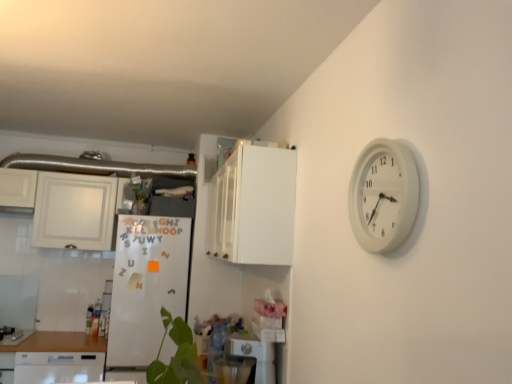
Locate an element on the screen. white plastic wall clock at upper right is located at coordinates (383, 195).

What is the approximate height of white glossy dishwasher at lower left?

white glossy dishwasher at lower left is 17.76 inches in height.

This screenshot has height=384, width=512. What are the coordinates of `white glossy cabinet at upper center, which is the first cabinetry in front-to-back order` in the screenshot? It's located at (253, 207).

From the image's perspective, would you say white glossy cabinet at upper left, placed as the second cabinetry when sorted from front to back, is shown under brushed metal gas stove at lower left?

No, from the image's perspective, white glossy cabinet at upper left, placed as the second cabinetry when sorted from front to back, is not below brushed metal gas stove at lower left.

Between white glossy cabinet at upper left, the 1th cabinetry when ordered from back to front, and brushed metal gas stove at lower left, which one has smaller width?

With smaller width is white glossy cabinet at upper left, the 1th cabinetry when ordered from back to front.

Is point (103, 225) positioned after point (29, 330)?

No.

Between brushed metal gas stove at lower left and white plastic wall clock at upper right, which one has more height?

white plastic wall clock at upper right is taller.

Can you confirm if brushed metal gas stove at lower left is wider than white plastic wall clock at upper right?

Yes.

Which of these two, brushed metal gas stove at lower left or white plastic wall clock at upper right, is bigger?

Bigger between the two is brushed metal gas stove at lower left.

Is brushed metal gas stove at lower left aimed at white plastic wall clock at upper right?

No, brushed metal gas stove at lower left is not turned towards white plastic wall clock at upper right.

Find the location of a particular element. fridge that is above the white glossy dishwasher at lower left (from a real-world perspective) is located at coordinates [x=146, y=286].

Is the position of white glossy dishwasher at lower left less distant than that of white matte refrigerator at center-left?

That is True.

Is white glossy dishwasher at lower left oriented away from white matte refrigerator at center-left?

No, white glossy dishwasher at lower left's orientation is not away from white matte refrigerator at center-left.

How much distance is there between white glossy dishwasher at lower left and white matte refrigerator at center-left?

They are 18.00 inches apart.

Between white plastic dishwasher at lower center and white glossy cabinet at upper center, acting as the 1th cabinetry starting from the right, which one appears on the left side from the viewer's perspective?

white glossy cabinet at upper center, acting as the 1th cabinetry starting from the right, is more to the left.

Consider the image. Can you tell me how much white plastic dishwasher at lower center and white glossy cabinet at upper center, acting as the 1th cabinetry starting from the right, differ in facing direction?

The angle between the facing direction of white plastic dishwasher at lower center and the facing direction of white glossy cabinet at upper center, acting as the 1th cabinetry starting from the right, is 1.56 degrees.

Is white plastic dishwasher at lower center facing towards white glossy cabinet at upper center, acting as the 1th cabinetry starting from the right?

No.

The image size is (512, 384). Identify the location of home appliance behind the white plastic dishwasher at lower center. (58, 357).

Can you confirm if white plastic dishwasher at lower center is bigger than white glossy dishwasher at lower left?

Incorrect, white plastic dishwasher at lower center is not larger than white glossy dishwasher at lower left.

From a real-world perspective, is white plastic dishwasher at lower center physically located above or below white glossy dishwasher at lower left?

In terms of real-world spatial position, white plastic dishwasher at lower center is above white glossy dishwasher at lower left.

Which object is wider, white plastic dishwasher at lower center or white glossy dishwasher at lower left?

Wider between the two is white glossy dishwasher at lower left.

The image size is (512, 384). In order to click on home appliance in front of the white glossy cabinet at upper left, marked as the first cabinetry in a left-to-right arrangement in this screenshot , I will do `click(58, 357)`.

How distant is white glossy cabinet at upper left, marked as the first cabinetry in a left-to-right arrangement, from white glossy dishwasher at lower left?

A distance of 37.61 inches exists between white glossy cabinet at upper left, marked as the first cabinetry in a left-to-right arrangement, and white glossy dishwasher at lower left.

Does point (29, 192) appear closer or farther from the camera than point (59, 353)?

Point (29, 192) is farther from the camera than point (59, 353).

Is white plastic wall clock at upper right smaller than white matte refrigerator at center-left?

Yes.

Considering the sizes of white plastic wall clock at upper right and white matte refrigerator at center-left in the image, is white plastic wall clock at upper right taller or shorter than white matte refrigerator at center-left?

Considering their sizes, white plastic wall clock at upper right has less height than white matte refrigerator at center-left.

Would you consider white plastic wall clock at upper right to be distant from white matte refrigerator at center-left?

Yes, white plastic wall clock at upper right is far from white matte refrigerator at center-left.

Based on the photo, in terms of width, does white plastic wall clock at upper right look wider or thinner when compared to white matte refrigerator at center-left?

white plastic wall clock at upper right is thinner than white matte refrigerator at center-left.

In order to click on cabinetry behind the brushed metal gas stove at lower left in this screenshot , I will do `click(65, 206)`.

You are a GUI agent. You are given a task and a screenshot of the screen. Output one action in this format:
    pyautogui.click(x=<x>, y=<y>)
    Task: Click on the gas stove that appears below the white plastic wall clock at upper right (from a real-world perspective)
    
    Given the screenshot: What is the action you would take?
    pyautogui.click(x=16, y=337)

From the image, which object appears to be farther from white glossy dishwasher at lower left, white plastic wall clock at upper right or white glossy cabinet at upper left, placed as the second cabinetry when sorted from front to back?

white plastic wall clock at upper right.

Looking at the image, which one is located further to white glossy cabinet at upper left, the 1th cabinetry when ordered from back to front, white glossy dishwasher at lower left or brushed metal gas stove at lower left?

brushed metal gas stove at lower left.

Considering their positions, is white glossy cabinet at upper left, the 1th cabinetry when ordered from back to front, positioned closer to white plastic dishwasher at lower center than white glossy dishwasher at lower left?

Among the two, white glossy dishwasher at lower left is located nearer to white plastic dishwasher at lower center.

Based on their spatial positions, is white glossy dishwasher at lower left or white glossy cabinet at upper left, marked as the first cabinetry in a left-to-right arrangement, closer to brushed metal gas stove at lower left?

white glossy dishwasher at lower left is positioned closer to the anchor brushed metal gas stove at lower left.

Based on their spatial positions, is white glossy cabinet at upper left, the 1th cabinetry when ordered from back to front, or white plastic wall clock at upper right closer to brushed metal gas stove at lower left?

white glossy cabinet at upper left, the 1th cabinetry when ordered from back to front, is positioned closer to the anchor brushed metal gas stove at lower left.

Looking at the image, which one is located closer to white glossy dishwasher at lower left, white glossy cabinet at upper center, which appears as the second cabinetry when viewed from the left, or white plastic dishwasher at lower center?

white plastic dishwasher at lower center.

Estimate the real-world distances between objects in this image. Which object is closer to brushed metal gas stove at lower left, white glossy cabinet at upper center, which is counted as the 2th cabinetry, starting from the back, or white plastic wall clock at upper right?

Based on the image, white glossy cabinet at upper center, which is counted as the 2th cabinetry, starting from the back, appears to be nearer to brushed metal gas stove at lower left.

Based on their spatial positions, is brushed metal gas stove at lower left or white glossy dishwasher at lower left further from white glossy cabinet at upper center, which appears as the second cabinetry when viewed from the left?

The object further to white glossy cabinet at upper center, which appears as the second cabinetry when viewed from the left, is brushed metal gas stove at lower left.

The width and height of the screenshot is (512, 384). Identify the location of fridge between white glossy cabinet at upper left, the 1th cabinetry when ordered from back to front, and white glossy dishwasher at lower left in the up-down direction. (146, 286).

What are the coordinates of `fridge between brushed metal gas stove at lower left and white plastic dishwasher at lower center` in the screenshot? It's located at (146, 286).

Locate an element on the screen. cabinetry located between white plastic wall clock at upper right and white glossy cabinet at upper left, placed as the second cabinetry when sorted from front to back, in the depth direction is located at coordinates (253, 207).

What are the coordinates of `dish washer between white plastic wall clock at upper right and white glossy cabinet at upper left, marked as the first cabinetry in a left-to-right arrangement, in the front-back direction` in the screenshot? It's located at (254, 355).